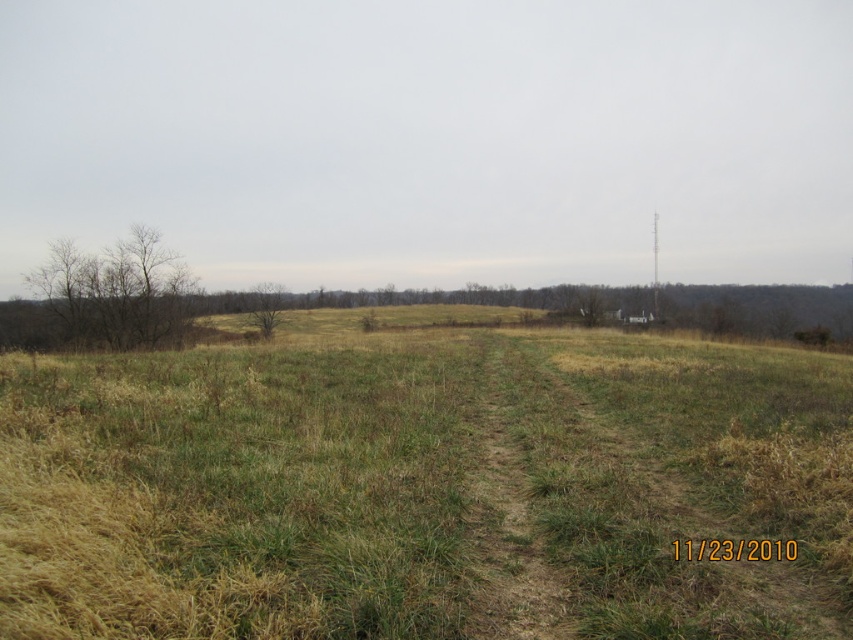
Question: Which object appears closest to the camera in this image?

Choices:
 (A) green grassy field at center
 (B) brown rough tree at center
 (C) brown dirt trail at center
 (D) bare branches at left

Answer: (A)

Question: Which of the following is the farthest from the observer?

Choices:
 (A) (160, 490)
 (B) (256, 316)
 (C) (480, 557)

Answer: (B)

Question: Which point is closer to the camera?

Choices:
 (A) (247, 321)
 (B) (138, 241)
 (C) (590, 515)
 (D) (474, 540)

Answer: (D)

Question: From the image, what is the correct spatial relationship of bare branches at left in relation to brown rough tree at center?

Choices:
 (A) above
 (B) below

Answer: (B)

Question: Does brown dirt trail at center have a smaller size compared to bare branches at left?

Choices:
 (A) yes
 (B) no

Answer: (A)

Question: Does brown dirt trail at center have a greater width compared to brown rough tree at center?

Choices:
 (A) no
 (B) yes

Answer: (A)